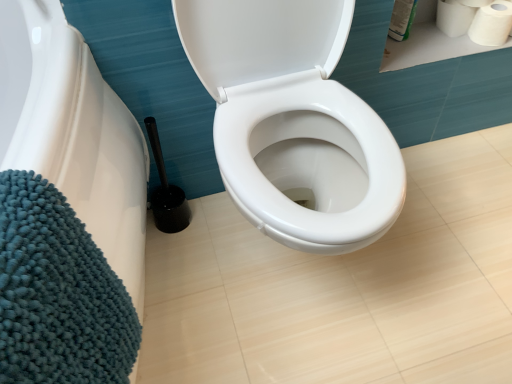
Where is `vacant space situated on the left part of white matte toilet paper at upper right, the 1th toilet paper positioned from the right`? vacant space situated on the left part of white matte toilet paper at upper right, the 1th toilet paper positioned from the right is located at coordinates (439, 42).